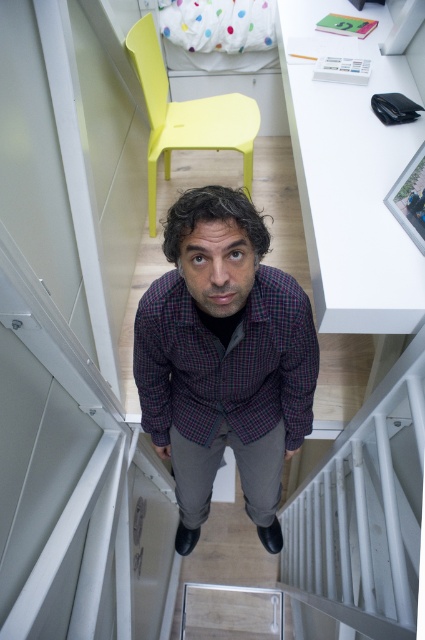
Question: Among these objects, which one is farthest from the camera?

Choices:
 (A) plaid fabric shirt at center
 (B) yellow plastic chair at upper center

Answer: (B)

Question: Does plaid fabric shirt at center have a smaller size compared to yellow plastic chair at upper center?

Choices:
 (A) no
 (B) yes

Answer: (A)

Question: Can you confirm if plaid fabric shirt at center is smaller than yellow plastic chair at upper center?

Choices:
 (A) no
 (B) yes

Answer: (A)

Question: Among these points, which one is nearest to the camera?

Choices:
 (A) (226, 392)
 (B) (172, 131)

Answer: (A)

Question: Is plaid fabric shirt at center to the right of yellow plastic chair at upper center from the viewer's perspective?

Choices:
 (A) no
 (B) yes

Answer: (B)